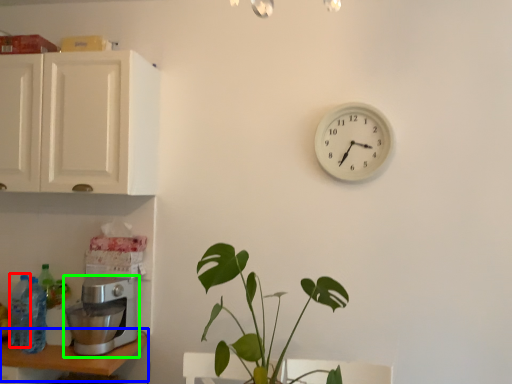
Question: Considering the real-world distances, which object is closest to bottle (highlighted by a red box)? table (highlighted by a blue box) or coffee maker (highlighted by a green box).

Choices:
 (A) table
 (B) coffee maker

Answer: (A)